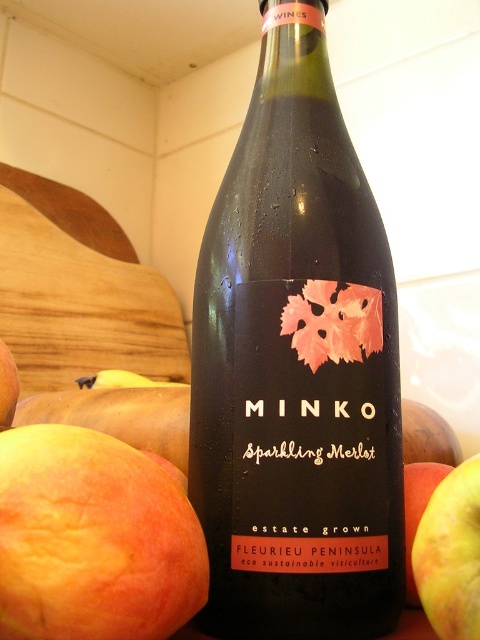
Question: Where is ripe peach at lower left located in relation to smooth yellow apple at right in the image?

Choices:
 (A) above
 (B) below

Answer: (A)

Question: Which object appears closest to the camera in this image?

Choices:
 (A) yellow matte apple at lower right
 (B) smooth yellow apple at right

Answer: (A)

Question: Which object appears farthest from the camera in this image?

Choices:
 (A) matte glass bottle at center
 (B) smooth yellow apple at right
 (C) ripe peach at lower left

Answer: (B)

Question: Estimate the real-world distances between objects in this image. Which object is farther from the yellow matte apple at lower right?

Choices:
 (A) smooth yellow apple at right
 (B) matte glass bottle at center

Answer: (B)

Question: Is matte glass bottle at center to the left of ripe peach at lower left from the viewer's perspective?

Choices:
 (A) no
 (B) yes

Answer: (A)

Question: Does matte glass bottle at center appear under smooth yellow apple at right?

Choices:
 (A) yes
 (B) no

Answer: (B)